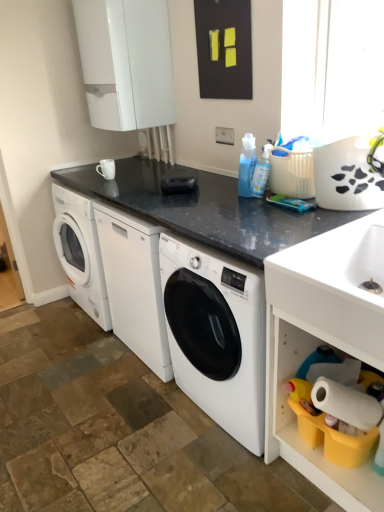
I want to click on free space to the left of blue glossy bottle at center, so click(210, 196).